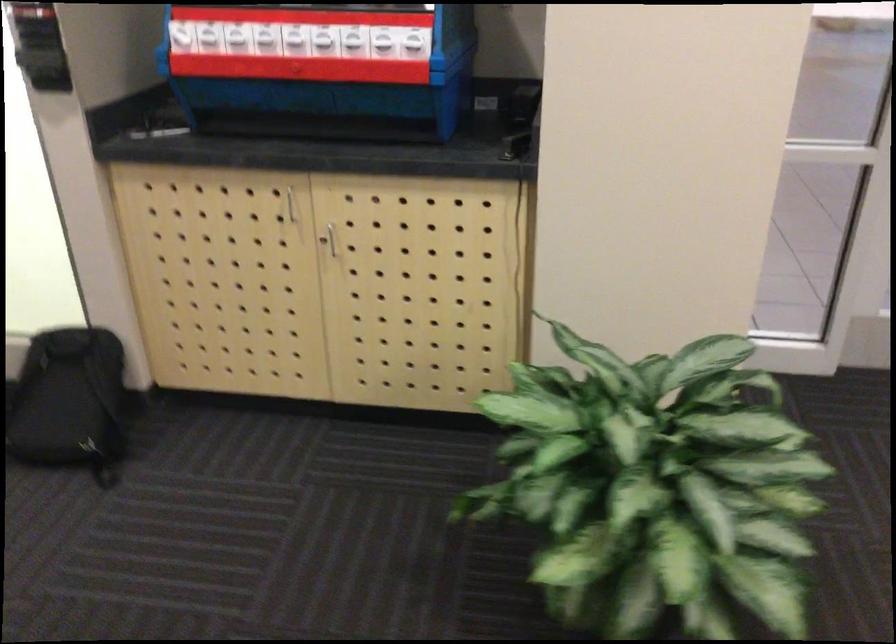
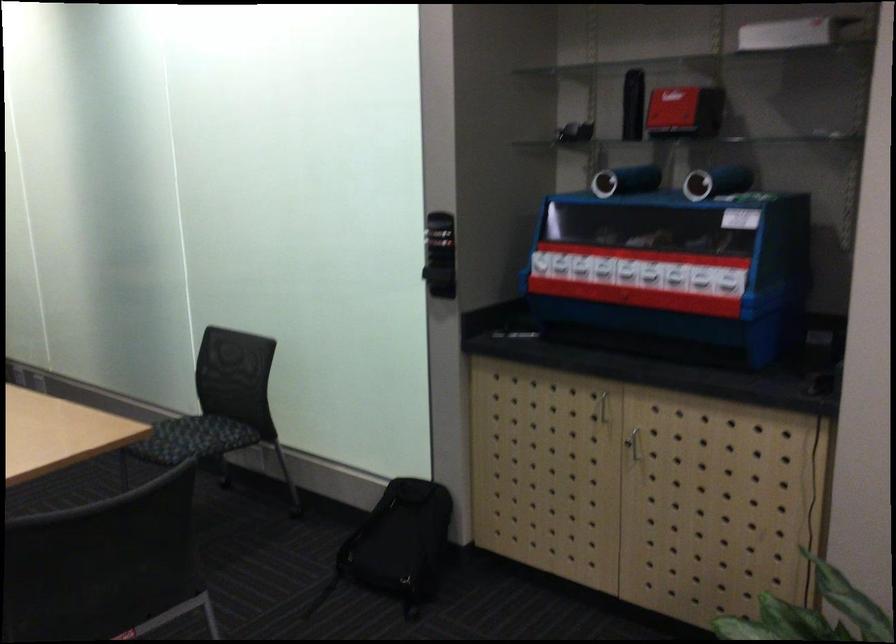
In the second image, find the point that corresponds to (x=281, y=210) in the first image.

(601, 406)